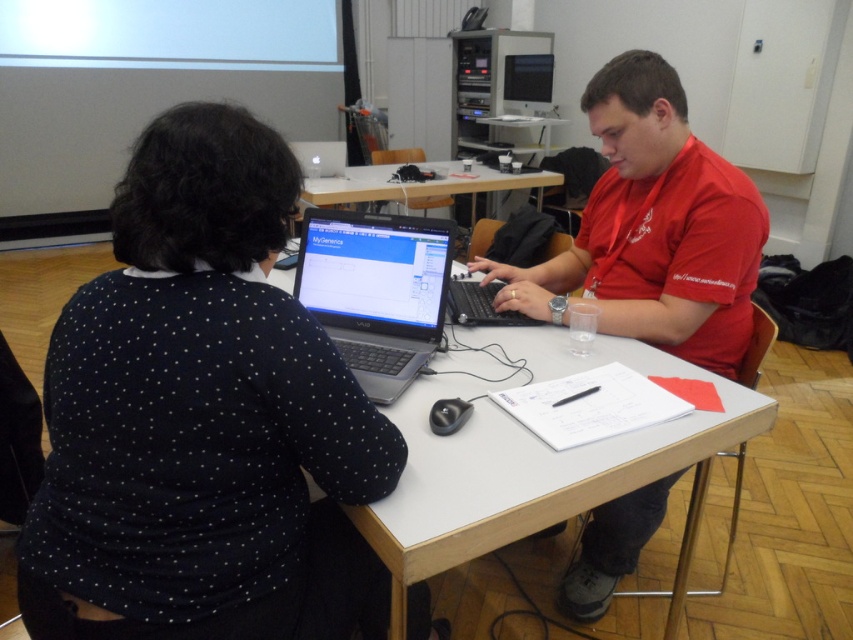
Does black dotted sweater at center have a larger size compared to black matte laptop at center?

Correct, black dotted sweater at center is larger in size than black matte laptop at center.

Who is positioned more to the right, black dotted sweater at center or black matte laptop at center?

Positioned to the right is black matte laptop at center.

Identify the location of black dotted sweater at center. (202, 419).

Between white wood table at center and black matte laptop at center, which one is positioned higher?

black matte laptop at center is higher up.

Can you confirm if white wood table at center is positioned to the right of black matte laptop at center?

No, white wood table at center is not to the right of black matte laptop at center.

Is point (752, 396) more distant than point (491, 316)?

That is False.

Locate an element on the screen. The width and height of the screenshot is (853, 640). white wood table at center is located at coordinates (534, 458).

At what (x,y) coordinates should I click in order to perform the action: click on red matte shirt at center. Please return your answer as a coordinate pair (x, y). Looking at the image, I should click on (654, 227).

Does red matte shirt at center have a smaller size compared to satin black laptop at center?

Actually, red matte shirt at center might be larger than satin black laptop at center.

Image resolution: width=853 pixels, height=640 pixels. Identify the location of red matte shirt at center. (654, 227).